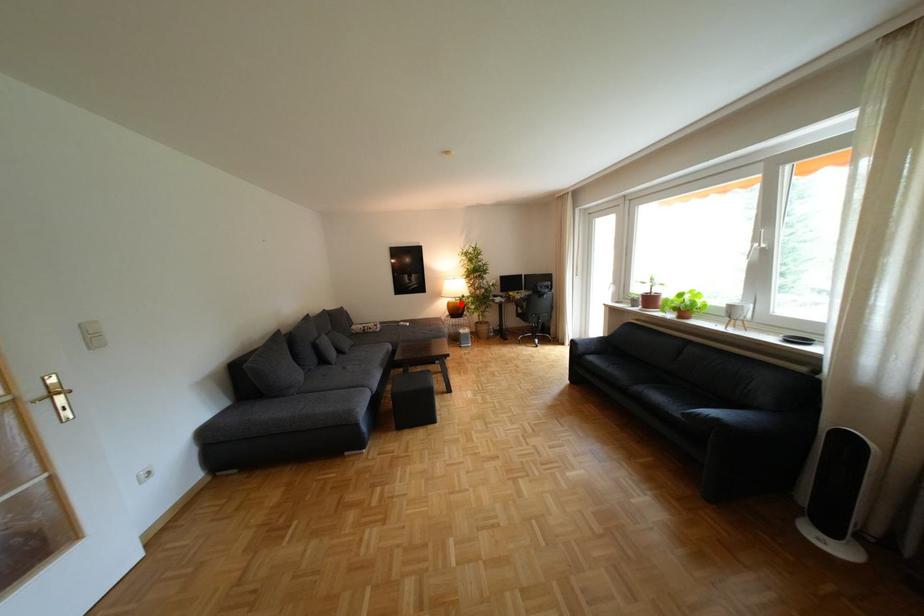
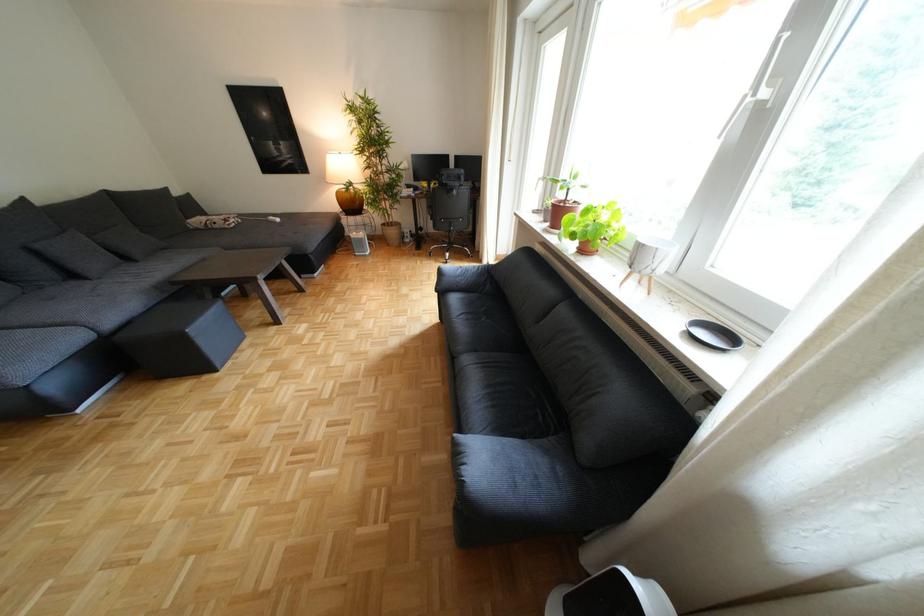
In the second image, find the point that corresponds to the highlighted location in the first image.

(351, 193)